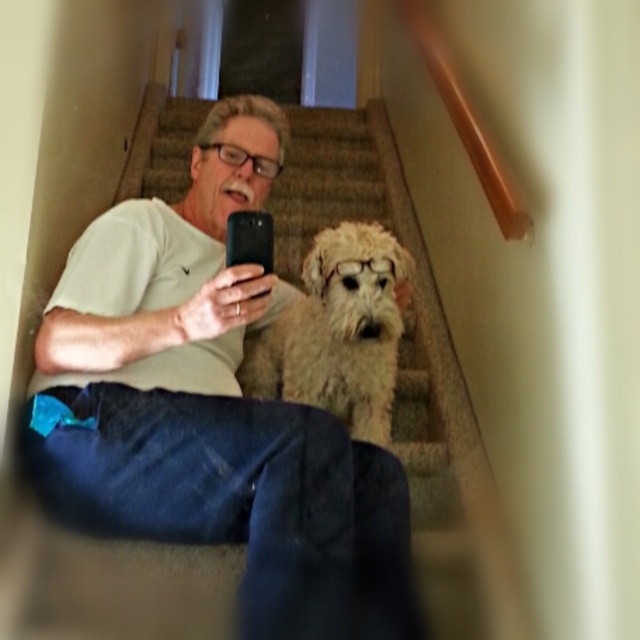
Question: Which of the following is the closest to the observer?

Choices:
 (A) white cotton shirt at center
 (B) fuzzy beige dog at center

Answer: (A)

Question: Does white cotton shirt at center appear over fuzzy beige dog at center?

Choices:
 (A) no
 (B) yes

Answer: (B)

Question: Which object is closer to the camera taking this photo?

Choices:
 (A) fuzzy beige dog at center
 (B) white cotton shirt at center

Answer: (B)

Question: Observing the image, what is the correct spatial positioning of white cotton shirt at center in reference to fuzzy beige dog at center?

Choices:
 (A) left
 (B) right

Answer: (A)

Question: In this image, where is white cotton shirt at center located relative to fuzzy beige dog at center?

Choices:
 (A) right
 (B) left

Answer: (B)

Question: Which of the following is the closest to the observer?

Choices:
 (A) (301, 381)
 (B) (170, 332)

Answer: (B)